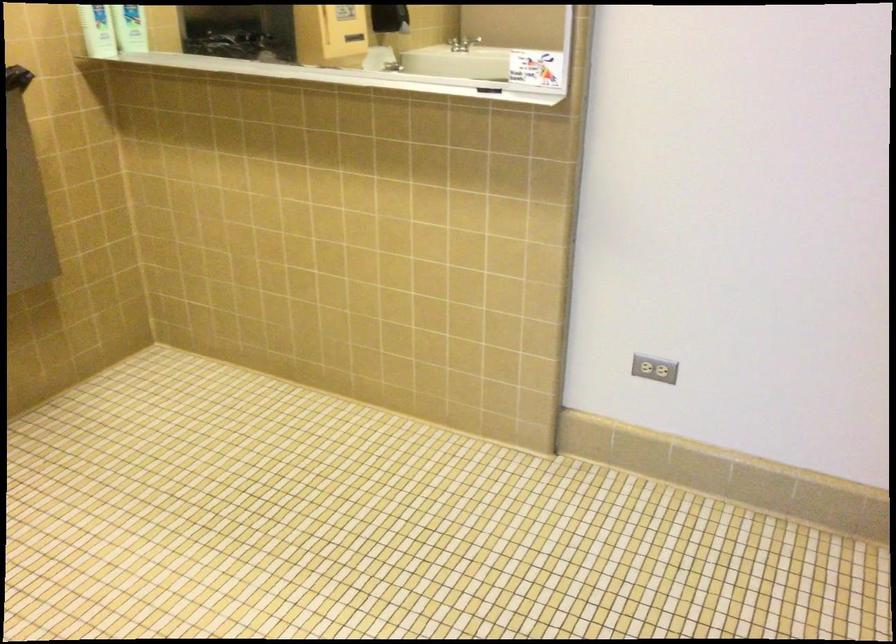
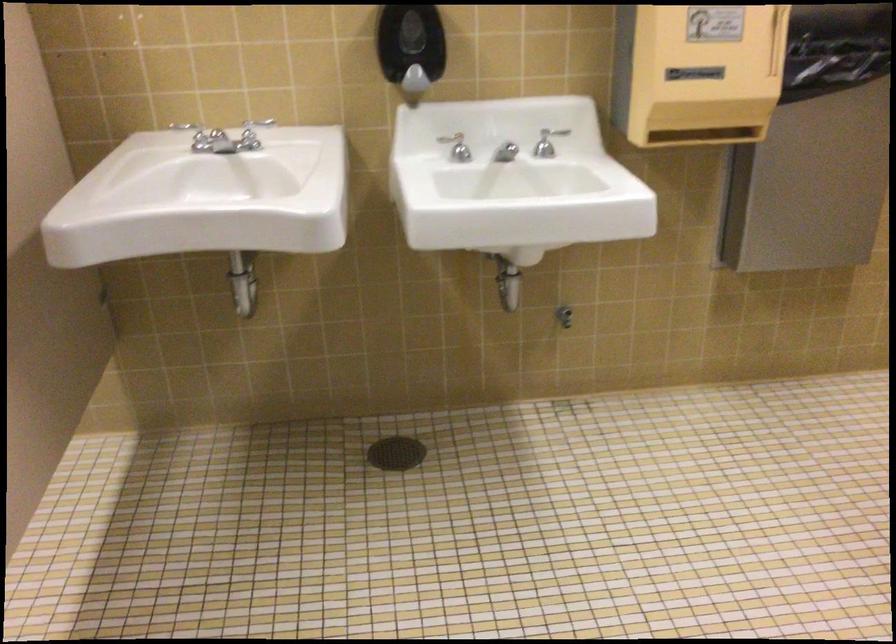
Question: Based on the continuous images, in which direction is the camera rotating? Reply with the corresponding letter.

Choices:
 (A) Left
 (B) Right
 (C) Up
 (D) Down

Answer: (A)